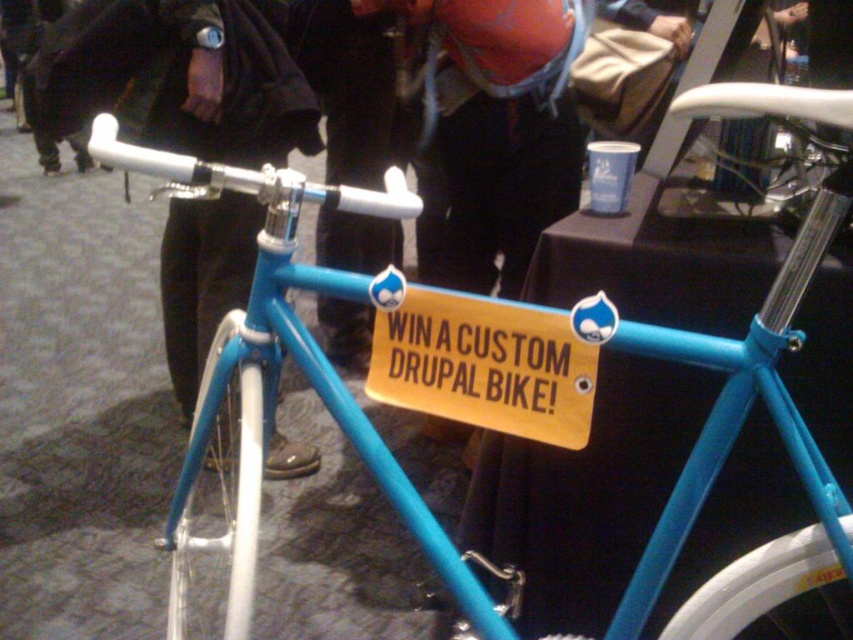
You are at a convention and see two points marked on the floor. The first point is labeled as point (190, 403) and the second is point (445, 337). If you are facing the direction of the blue bicycle, which point is closer to you?

Point (190, 403) is behind point (445, 337), so the point closer to you when facing the blue bicycle is point (445, 337).

You are standing in the convention hall and want to find the person wearing the matte black jacket at center. According to the coordinates provided, where should you look to find them?

The person wearing the matte black jacket at center is located at the 2D coordinates point [178,76].

You are attending an event and see the vibrant blue bicycle with white handlebars and wheels. You notice two items near the center of the bike frame. Which item is located to the left of the other? The items are the matte black jacket at center and the yellow paper sign at center.

The matte black jacket at center is positioned on the left side of yellow paper sign at center.